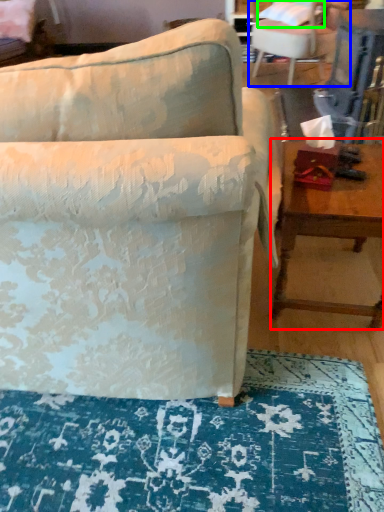
Question: Estimate the real-world distances between objects in this image. Which object is farther from table (highlighted by a red box), chair (highlighted by a blue box) or pillow (highlighted by a green box)?

Choices:
 (A) chair
 (B) pillow

Answer: (B)